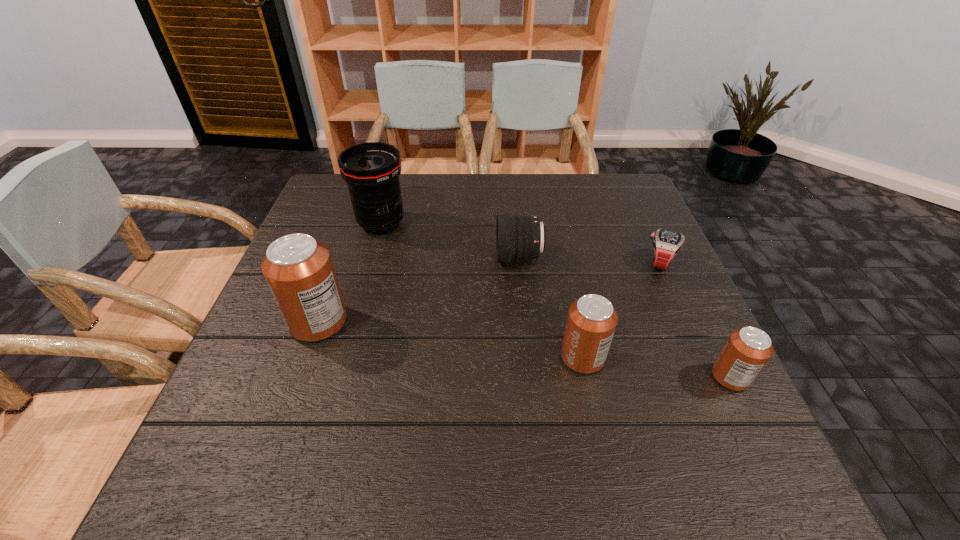
Identify the location of free location located on the left of the second can from right to left. (462, 357).

Find the location of a particular element. The width and height of the screenshot is (960, 540). vacant space located 0.110m on the left of the rightmost can is located at coordinates (656, 377).

Identify the location of free space located at the front element of the right telephoto lens. The width and height of the screenshot is (960, 540). (371, 257).

Where is `vacant space situated at the front element of the right telephoto lens`? The image size is (960, 540). vacant space situated at the front element of the right telephoto lens is located at coordinates (344, 257).

In order to click on free location located at the front element of the right telephoto lens in this screenshot , I will do `click(379, 257)`.

The width and height of the screenshot is (960, 540). I want to click on vacant space situated on the right of the farthest object, so click(x=455, y=224).

Locate an element on the screen. This screenshot has width=960, height=540. vacant space located 0.250m on the front of the shortest object is located at coordinates (705, 361).

Where is `object that is at the far edge`? The width and height of the screenshot is (960, 540). object that is at the far edge is located at coordinates (371, 170).

Image resolution: width=960 pixels, height=540 pixels. What are the coordinates of `object located in the near edge section of the desktop` in the screenshot? It's located at point(747,350).

At what (x,y) coordinates should I click in order to perform the action: click on can that is at the left edge. Please return your answer as a coordinate pair (x, y). The height and width of the screenshot is (540, 960). Looking at the image, I should click on (298, 269).